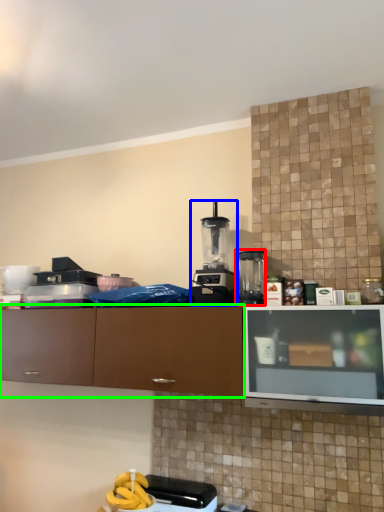
Question: Which object is positioned closest to kitchen appliance (highlighted by a red box)? Select from kitchen appliance (highlighted by a blue box) and cabinetry (highlighted by a green box).

Choices:
 (A) kitchen appliance
 (B) cabinetry

Answer: (A)